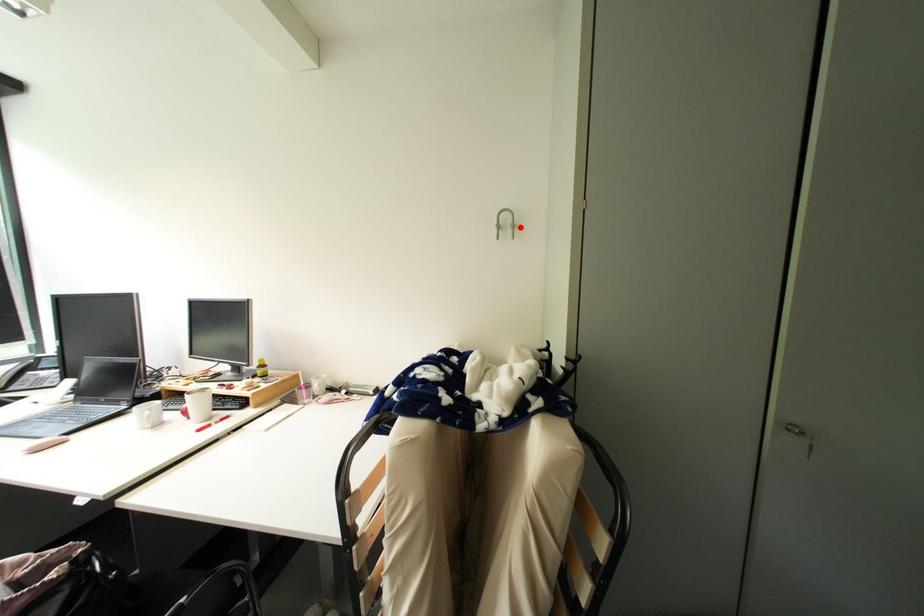
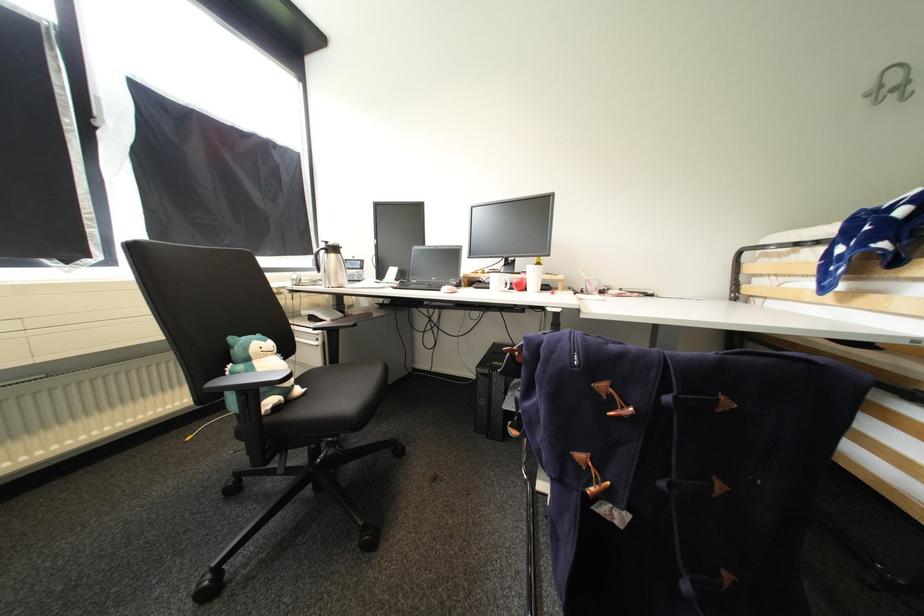
In the second image, find the point that corresponds to the highlighted location in the first image.

(912, 84)